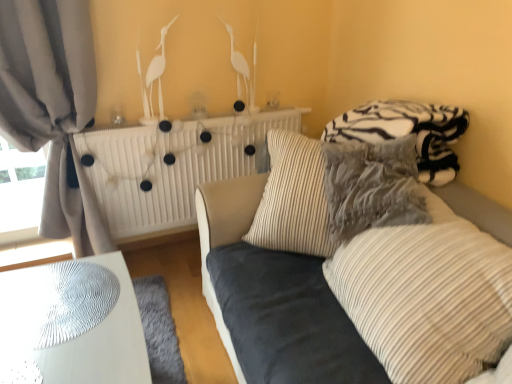
Find the location of a particular element. free location above white glossy table at lower left (from a real-world perspective) is located at coordinates (65, 319).